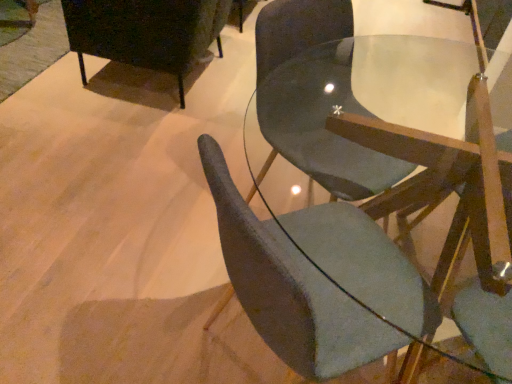
Where is `free space in front of matte black cabinet at upper left, which is the first chair from left to right`? free space in front of matte black cabinet at upper left, which is the first chair from left to right is located at coordinates (106, 145).